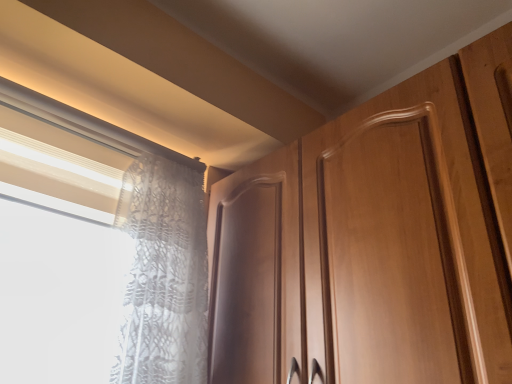
Question: Is white lace curtain at upper left looking in the opposite direction of white lace curtain at left?

Choices:
 (A) no
 (B) yes

Answer: (A)

Question: Is white lace curtain at upper left placed right next to white lace curtain at left?

Choices:
 (A) yes
 (B) no

Answer: (A)

Question: Is the depth of white lace curtain at upper left less than that of white lace curtain at left?

Choices:
 (A) no
 (B) yes

Answer: (B)

Question: Does white lace curtain at upper left appear on the left side of white lace curtain at left?

Choices:
 (A) yes
 (B) no

Answer: (A)

Question: Is white lace curtain at left surrounded by white lace curtain at upper left?

Choices:
 (A) yes
 (B) no

Answer: (B)

Question: From a real-world perspective, is white lace curtain at upper left physically above white lace curtain at left?

Choices:
 (A) yes
 (B) no

Answer: (A)

Question: From the image's perspective, is white lace curtain at left on top of white lace curtain at upper left?

Choices:
 (A) yes
 (B) no

Answer: (B)

Question: Does white lace curtain at left have a lesser height compared to white lace curtain at upper left?

Choices:
 (A) no
 (B) yes

Answer: (A)

Question: Is white lace curtain at left surrounding white lace curtain at upper left?

Choices:
 (A) no
 (B) yes

Answer: (A)

Question: From a real-world perspective, is white lace curtain at left beneath white lace curtain at upper left?

Choices:
 (A) yes
 (B) no

Answer: (A)

Question: Is white lace curtain at left positioned in front of white lace curtain at upper left?

Choices:
 (A) no
 (B) yes

Answer: (A)

Question: Considering the relative positions of white lace curtain at left and white lace curtain at upper left in the image provided, is white lace curtain at left to the right of white lace curtain at upper left from the viewer's perspective?

Choices:
 (A) yes
 (B) no

Answer: (A)

Question: Is white lace curtain at left bigger or smaller than white lace curtain at upper left?

Choices:
 (A) big
 (B) small

Answer: (A)